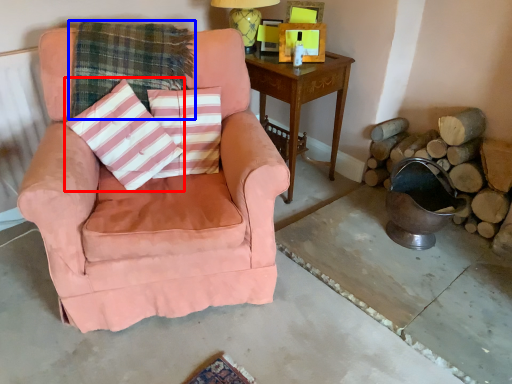
Question: Which point is further to the camera, throw pillow (highlighted by a red box) or plaid (highlighted by a blue box)?

Choices:
 (A) throw pillow
 (B) plaid

Answer: (B)